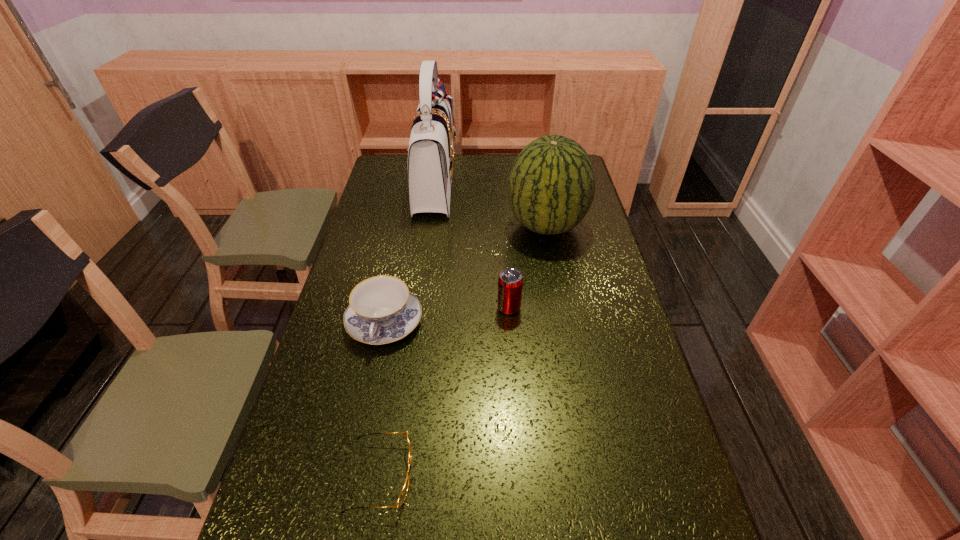
Locate an element on the screen. This screenshot has width=960, height=540. satchel is located at coordinates (431, 156).

Find the location of a particular element. The image size is (960, 540). watermelon is located at coordinates (551, 187).

In order to click on soda can in this screenshot , I will do `click(510, 282)`.

Identify the location of chinaware. The image size is (960, 540). (382, 310).

Image resolution: width=960 pixels, height=540 pixels. Identify the location of the shortest object. (403, 493).

The height and width of the screenshot is (540, 960). I want to click on spectacles, so click(403, 493).

The width and height of the screenshot is (960, 540). What are the coordinates of `free region located on the front-facing side of the tallest object` in the screenshot? It's located at (510, 185).

In order to click on free point located on the left of the second tallest object in this screenshot , I will do `click(458, 226)`.

Locate an element on the screen. This screenshot has width=960, height=540. free location located 0.300m on the left of the soda can is located at coordinates (397, 308).

Find the location of `free space located with the handle on the side of the chinaware`. free space located with the handle on the side of the chinaware is located at coordinates [x=363, y=426].